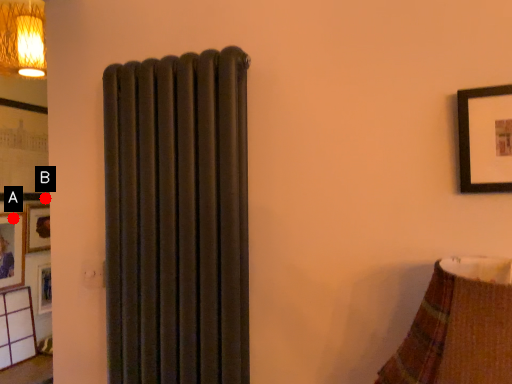
Question: Two points are circled on the image, labeled by A and B beside each circle. Which of the following is the farthest from the observer?

Choices:
 (A) A is further
 (B) B is further

Answer: (B)